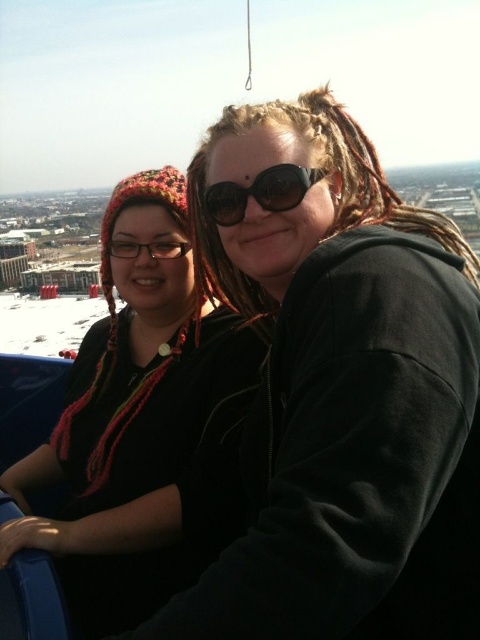
Between point (343, 276) and point (284, 189), which one is positioned behind?

The point (284, 189) is more distant.

Does black matte hoodie at center appear on the left side of black matte goggles at center?

No, black matte hoodie at center is not to the left of black matte goggles at center.

You are a GUI agent. You are given a task and a screenshot of the screen. Output one action in this format:
    pyautogui.click(x=<x>, y=<y>)
    Task: Click on the black matte hoodie at center
    
    Given the screenshot: What is the action you would take?
    pyautogui.click(x=339, y=400)

Is black matte hoodie at center closer to the viewer compared to knitted wool hat at left?

Yes.

Between black matte hoodie at center and knitted wool hat at left, which one has less height?

knitted wool hat at left

Describe the element at coordinates (339, 400) in the screenshot. I see `black matte hoodie at center` at that location.

The image size is (480, 640). I want to click on black matte hoodie at center, so click(x=339, y=400).

Can you confirm if knitted wool hat at left is bigger than black matte goggles at center?

Indeed, knitted wool hat at left has a larger size compared to black matte goggles at center.

Consider the image. Between knitted wool hat at left and black matte goggles at center, which one has more height?

knitted wool hat at left is taller.

Which is in front, point (143, 326) or point (274, 172)?

Positioned in front is point (274, 172).

The image size is (480, 640). What are the coordinates of `knitted wool hat at left` in the screenshot? It's located at (134, 413).